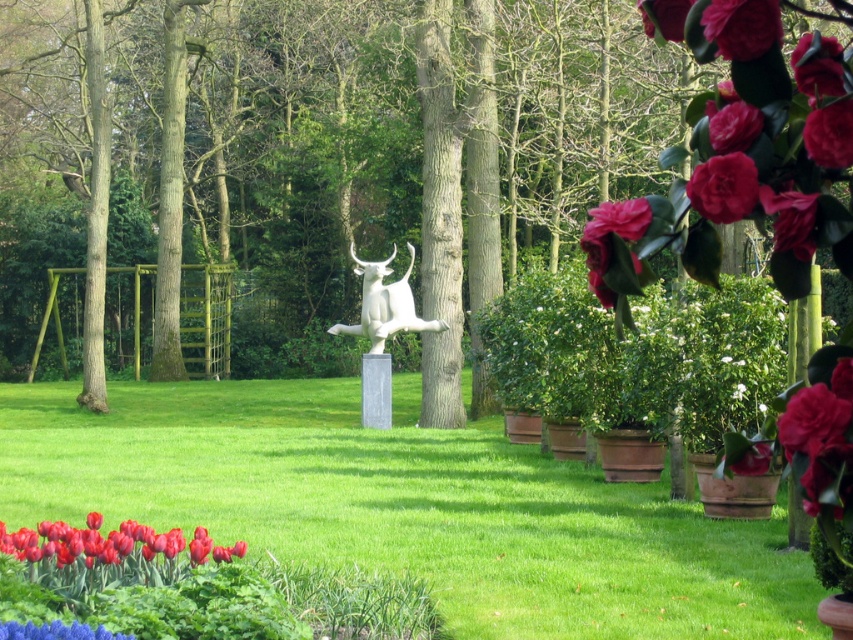
You are a gardener planning to water the green matte tree at center and the smooth glossy tulip at lower left. Which plant should you water first if you want to start from the lower part of the garden?

You should water the smooth glossy tulip at lower left first because it is positioned lower than the green matte tree at center, which is above it.

You are standing in the garden scene and want to take a photo of the green matte tree at center. Where should you position yourself to capture it in the frame?

To capture the green matte tree at center in the frame, position yourself so that the tree is centered at the coordinates approximately 0.208 on the x and 0.479 on the y axis.